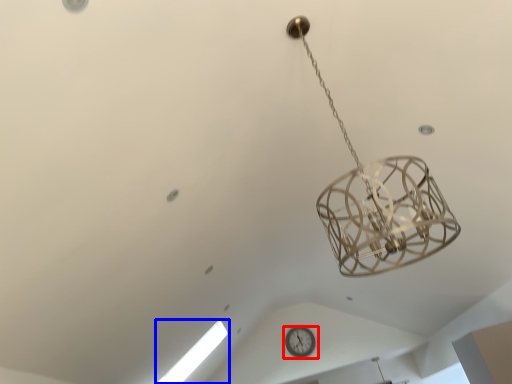
Question: Which object is further to the camera taking this photo, wall clock (highlighted by a red box) or window (highlighted by a blue box)?

Choices:
 (A) wall clock
 (B) window

Answer: (A)